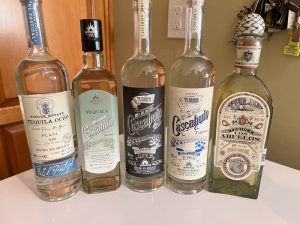
At what (x,y) coordinates should I click in order to perform the action: click on white countertop. Please return your answer as a coordinate pair (x, y). Looking at the image, I should click on (131, 210).